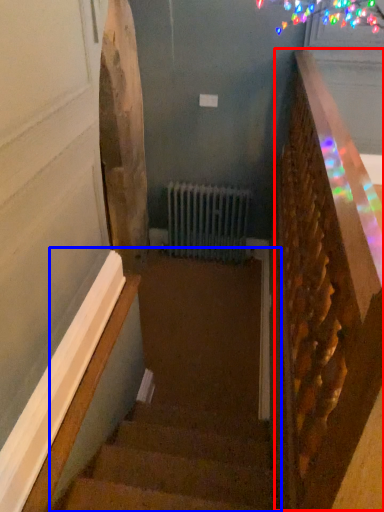
Question: Among these objects, which one is nearest to the camera, rail (highlighted by a red box) or stairs (highlighted by a blue box)?

Choices:
 (A) rail
 (B) stairs

Answer: (A)